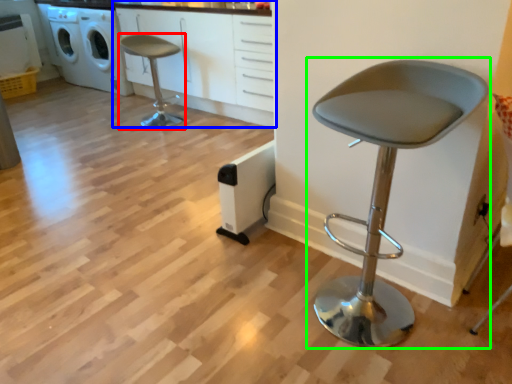
Question: Which object is positioned closest to chair (highlighted by a red box)? Select from cabinetry (highlighted by a blue box) and chair (highlighted by a green box).

Choices:
 (A) cabinetry
 (B) chair

Answer: (A)